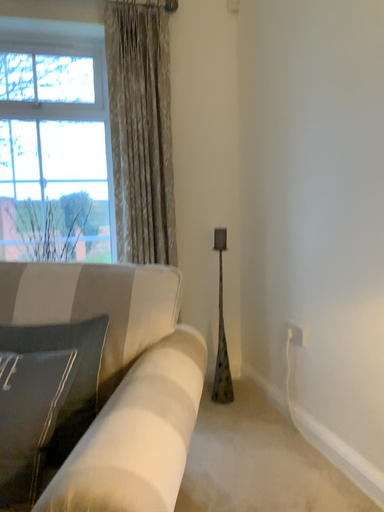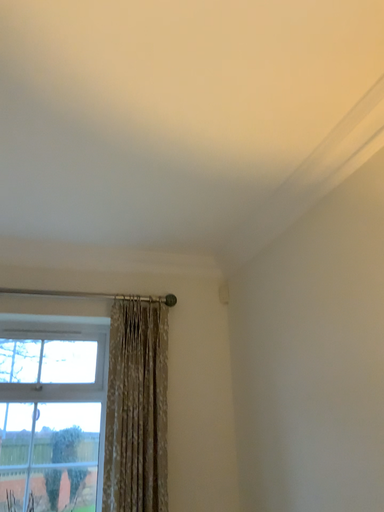
Question: How did the camera likely rotate when shooting the video?

Choices:
 (A) rotated downward
 (B) rotated upward

Answer: (B)